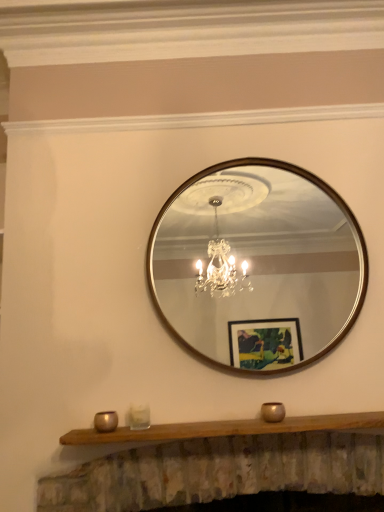
Question: Visually, is wooden-framed mirror at center positioned to the left or to the right of clear glass candle holder at lower center, which appears as the second candle holder when viewed from the left?

Choices:
 (A) right
 (B) left

Answer: (A)

Question: Is wooden-framed mirror at center spatially inside clear glass candle holder at lower center, which appears as the second candle holder when viewed from the left, or outside of it?

Choices:
 (A) outside
 (B) inside

Answer: (A)

Question: Estimate the real-world distances between objects in this image. Which object is closer to the metallic gold candle holder at lower center, which is the 1th candle holder in left-to-right order?

Choices:
 (A) gold metallic candle holder at lower center, the first candle holder when ordered from right to left
 (B) wooden mantle at center
 (C) clear glass candle holder at lower center, which is counted as the 2th candle holder, starting from the right
 (D) wooden-framed mirror at center

Answer: (C)

Question: Which object is positioned farthest from the gold metallic candle holder at lower center, marked as the third candle holder in a left-to-right arrangement?

Choices:
 (A) clear glass candle holder at lower center, which is counted as the 2th candle holder, starting from the right
 (B) metallic gold candle holder at lower center, arranged as the third candle holder when viewed from the right
 (C) wooden-framed mirror at center
 (D) wooden mantle at center

Answer: (C)